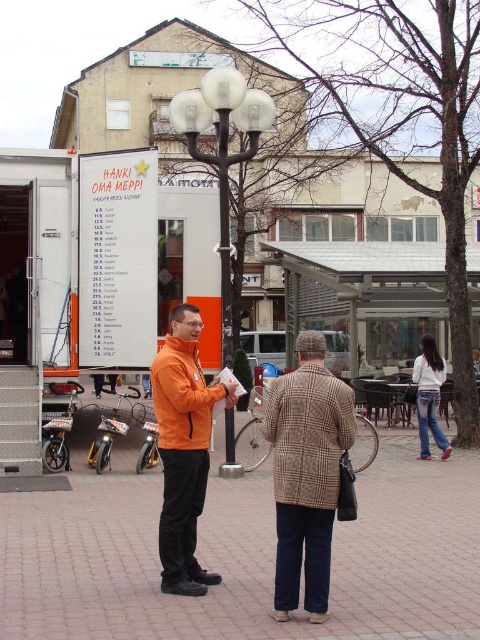
Question: Among these points, which one is farthest from the camera?

Choices:
 (A) (217, 154)
 (B) (330, 438)
 (C) (69, 621)

Answer: (A)

Question: Is brick pavement at center wider than orange matte jacket at center?

Choices:
 (A) no
 (B) yes

Answer: (B)

Question: Considering the real-world distances, which object is closest to the white glass lamp post at center?

Choices:
 (A) brick pavement at center
 (B) orange matte jacket at center

Answer: (B)

Question: Is plaid wool coat at center to the right of white glass lamp post at center from the viewer's perspective?

Choices:
 (A) no
 (B) yes

Answer: (B)

Question: Observing the image, what is the correct spatial positioning of brick pavement at center in reference to plaid wool coat at center?

Choices:
 (A) left
 (B) right

Answer: (A)

Question: Among these points, which one is farthest from the camera?

Choices:
 (A) (190, 140)
 (B) (336, 624)
 (C) (354, 422)
 (D) (423, 369)

Answer: (D)